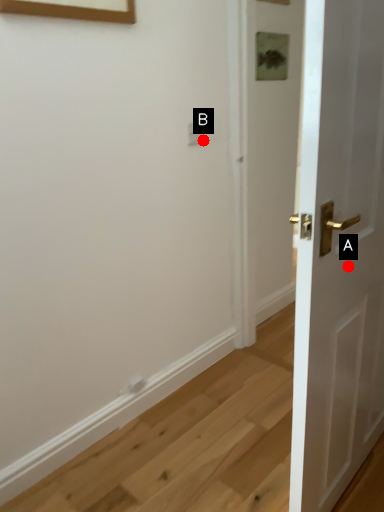
Question: Two points are circled on the image, labeled by A and B beside each circle. Which point is farther to the camera?

Choices:
 (A) A is further
 (B) B is further

Answer: (B)